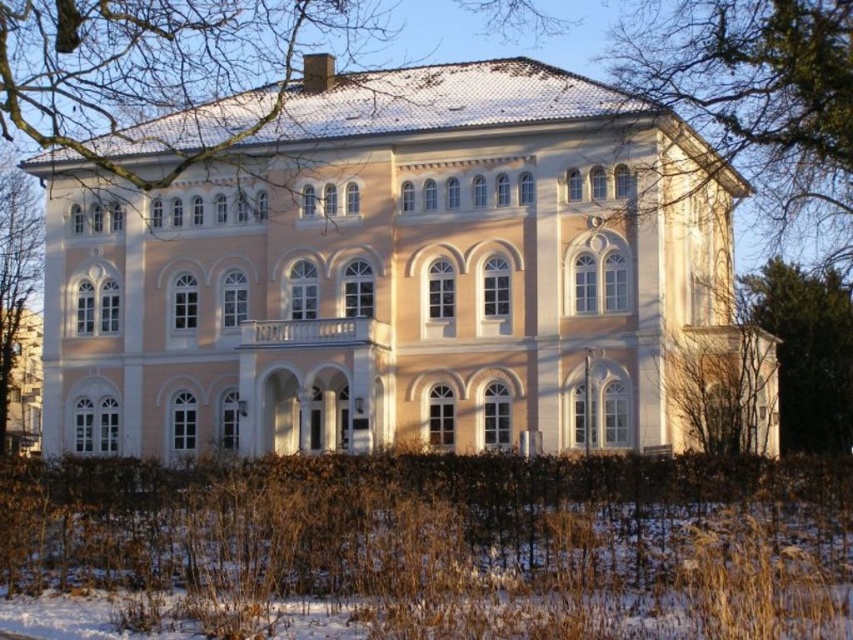
Does green leafy tree at right have a greater height compared to green leafy tree at left?

Incorrect, green leafy tree at right's height is not larger of green leafy tree at left's.

Does point (776, 308) come farther from viewer compared to point (6, 160)?

No.

Which is behind, point (844, 401) or point (12, 180)?

The point (12, 180) is more distant.

The height and width of the screenshot is (640, 853). I want to click on green leafy tree at right, so click(x=805, y=349).

Is beige/smooth mansion at center shorter than green leafy tree at right?

In fact, beige/smooth mansion at center may be taller than green leafy tree at right.

Based on the photo, who is more forward, (451,164) or (817,436)?

Point (451,164)

This screenshot has width=853, height=640. Identify the location of beige/smooth mansion at center. (393, 275).

Which is behind, point (221, 420) or point (722, 124)?

The point (221, 420) is more distant.

Can you confirm if beige/smooth mansion at center is thinner than green leafy tree at upper right?

In fact, beige/smooth mansion at center might be wider than green leafy tree at upper right.

Identify the location of beige/smooth mansion at center. (393, 275).

Find the location of a particular element. beige/smooth mansion at center is located at coordinates (393, 275).